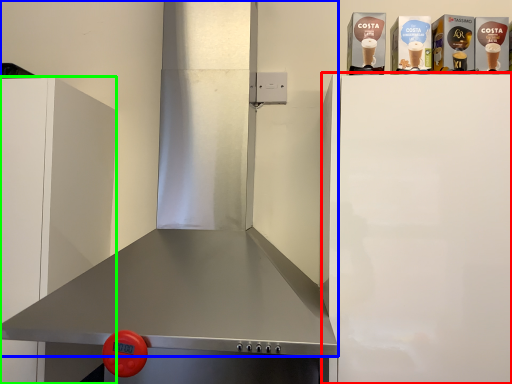
Question: Which is farther away from appliance (highlighted by a red box)? exhaust hood (highlighted by a blue box) or cabinetry (highlighted by a green box)?

Choices:
 (A) exhaust hood
 (B) cabinetry

Answer: (B)